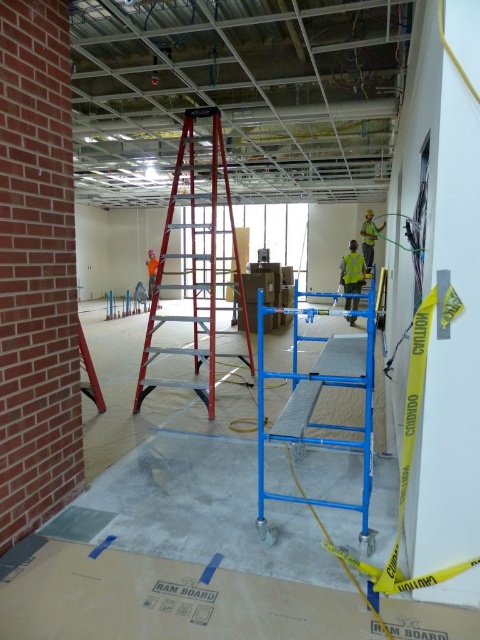
Question: Which point appears closest to the camera in this image?

Choices:
 (A) (276, 419)
 (B) (349, 285)
 (C) (203, 205)

Answer: (A)

Question: Where is red aluminum ladder at center located in relation to blue metallic scaffolding at center in the image?

Choices:
 (A) below
 (B) above

Answer: (B)

Question: Which of these objects is positioned farthest from the reflective yellow safety vest at right?

Choices:
 (A) blue metallic scaffolding at center
 (B) high visibility yellow safety vest at center
 (C) red aluminum ladder at center

Answer: (A)

Question: Can you confirm if red aluminum ladder at center is positioned to the right of blue metallic scaffolding at center?

Choices:
 (A) no
 (B) yes

Answer: (A)

Question: Is red aluminum ladder at center thinner than high visibility yellow safety vest at center?

Choices:
 (A) no
 (B) yes

Answer: (A)

Question: Which object is farther from the camera taking this photo?

Choices:
 (A) reflective yellow safety vest at right
 (B) blue metallic scaffolding at center
 (C) red aluminum ladder at center

Answer: (A)